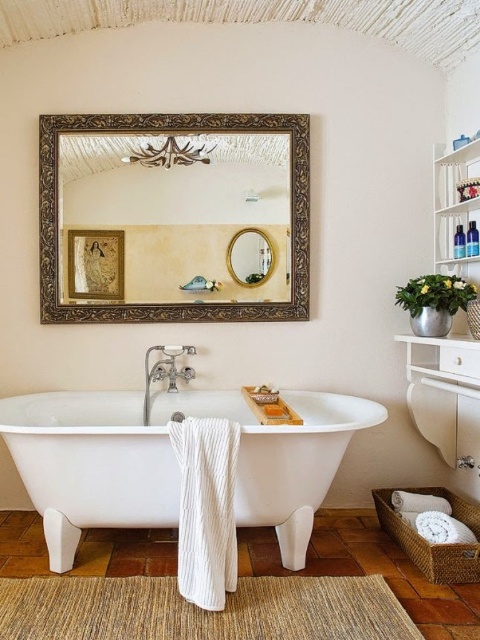
Between woven rattan basket at lower right and white plastic shelf at upper right, which one appears on the right side from the viewer's perspective?

white plastic shelf at upper right is more to the right.

Which is above, woven rattan basket at lower right or white plastic shelf at upper right?

white plastic shelf at upper right

The height and width of the screenshot is (640, 480). Describe the element at coordinates (430, 544) in the screenshot. I see `woven rattan basket at lower right` at that location.

Locate an element on the screen. woven rattan basket at lower right is located at coordinates (430, 544).

Is point (136, 442) positioned before point (453, 499)?

Yes, it is in front of point (453, 499).

Which of these two, white glossy bathtub at center or woven rattan basket at lower right, stands shorter?

woven rattan basket at lower right is shorter.

Locate an element on the screen. The height and width of the screenshot is (640, 480). white glossy bathtub at center is located at coordinates (172, 460).

Who is taller, gold ornate mirror at upper center or woven rattan basket at lower right?

With more height is gold ornate mirror at upper center.

Which is below, gold ornate mirror at upper center or woven rattan basket at lower right?

woven rattan basket at lower right

Is point (154, 193) behind point (458, 518)?

That is True.

At what (x,y) coordinates should I click in order to perform the action: click on gold ornate mirror at upper center. Please return your answer as a coordinate pair (x, y). Looking at the image, I should click on (173, 218).